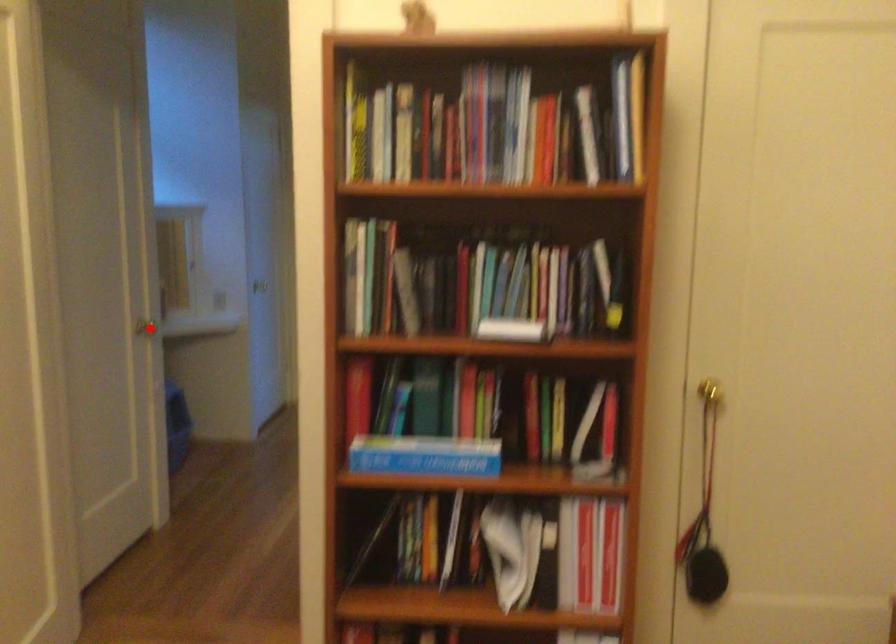
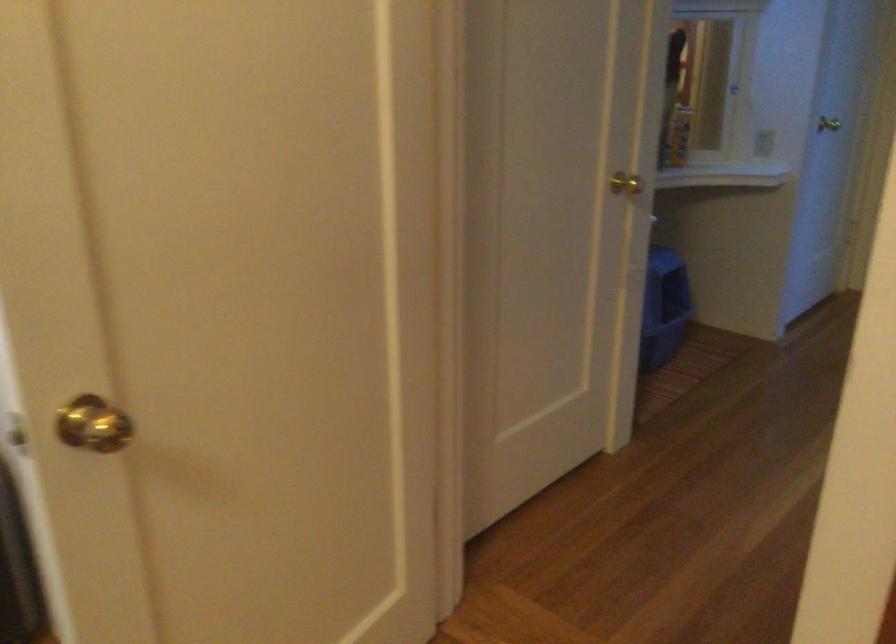
In the second image, find the point that corresponds to the highlighted location in the first image.

(625, 184)